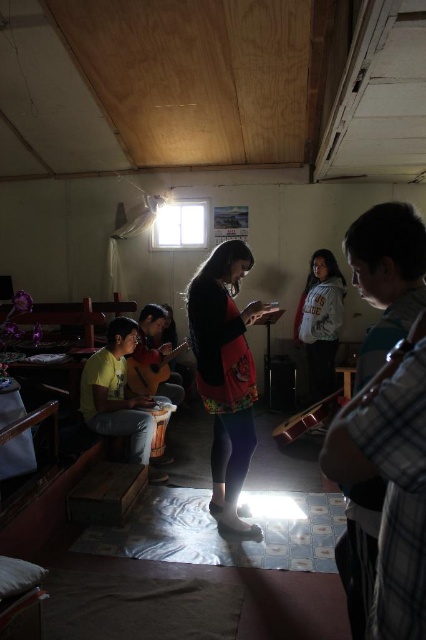
You are a photographer setting up for a group photo in the room. You need to arrange the lighting so that both the matte black sweater at center and the yellow matte shirt at left are well lit. Considering their heights, which person should you adjust the light angle for more precisely?

The matte black sweater at center is much taller than the yellow matte shirt at left, so you should adjust the light angle more precisely for the matte black sweater at center to ensure proper illumination given its greater height.

You are a photographer setting up for a group photo in the room. The matte black sweater at center and the yellow matte shirt at left are in your frame. To ensure both are visible, where should you position the camera relative to the two objects?

The matte black sweater at center is located above the yellow matte shirt at left, so positioning the camera slightly above the yellow matte shirt at left would allow both the matte black sweater at center and the yellow matte shirt at left to be visible in the frame.